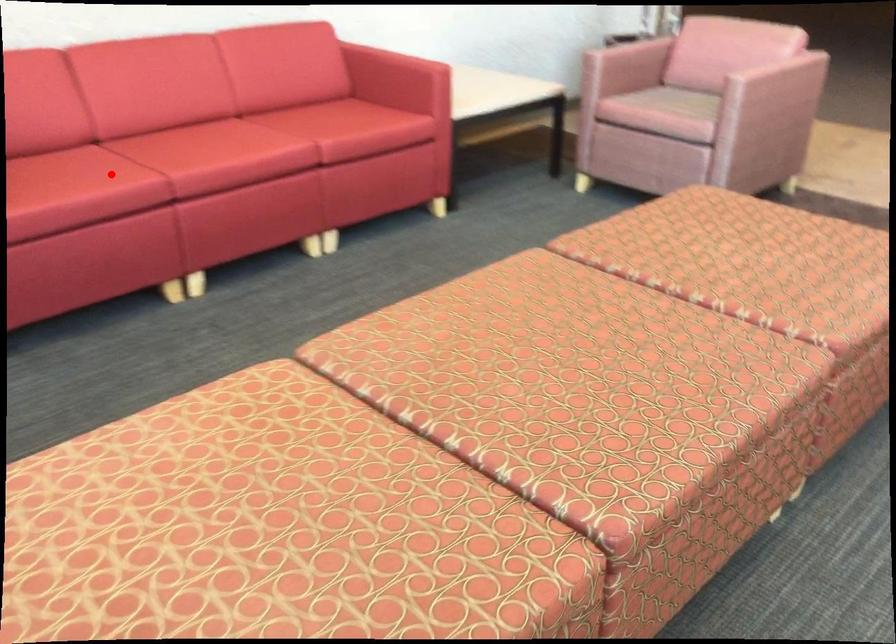
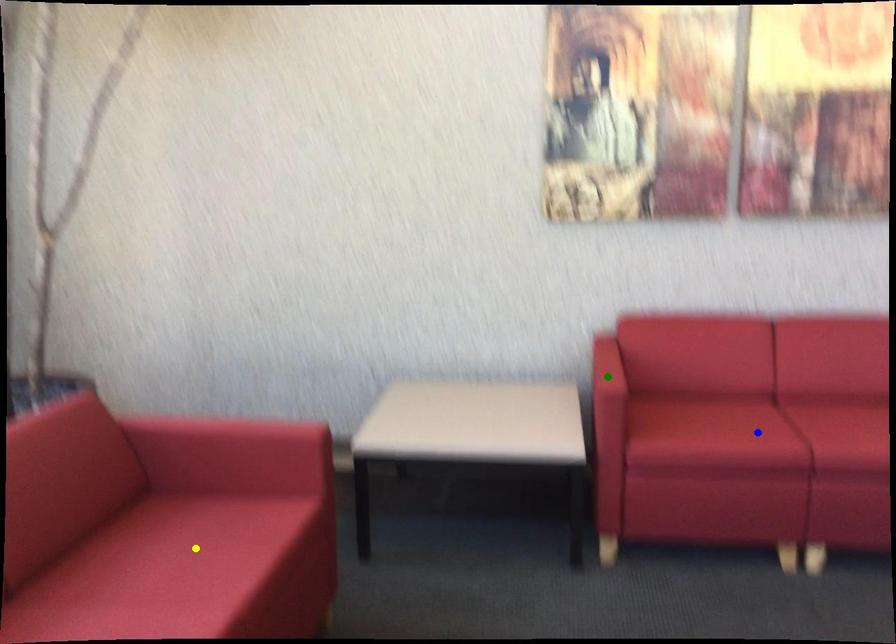
Question: I am providing you with two images of the same scene from different viewpoints. A red point is marked on the first image. You are given multiple points on the second image. In image 2, which mark is for the same physical point as the one in image 1?

Choices:
 (A) yellow point
 (B) blue point
 (C) green point

Answer: (B)